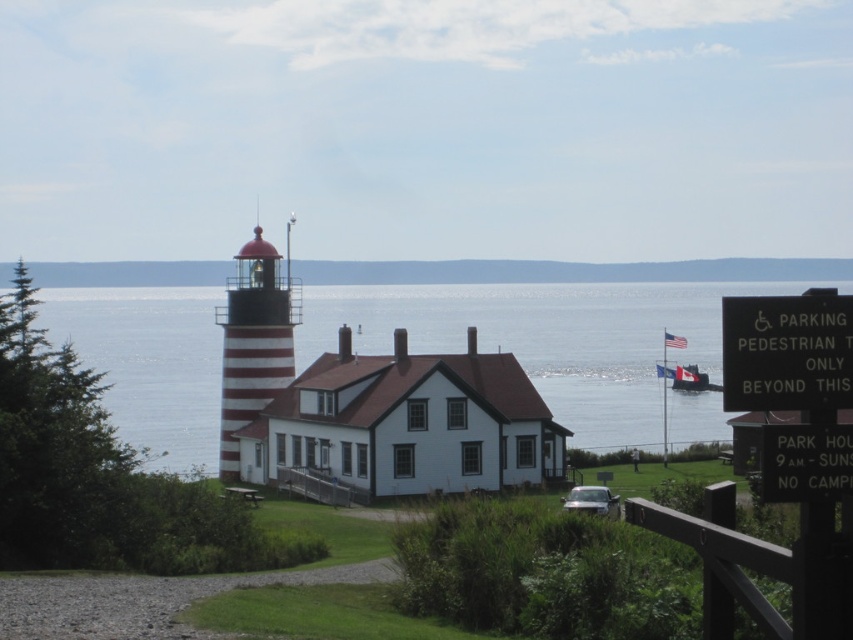
Between point (776, 445) and point (692, 381), which one is positioned in front?

Point (776, 445) is in front.

Can you confirm if black plastic sign at lower right is thinner than metallic gray boat at center?

Yes, black plastic sign at lower right is thinner than metallic gray boat at center.

Between point (805, 442) and point (675, 388), which one is positioned behind?

Point (675, 388)

This screenshot has height=640, width=853. Identify the location of black plastic sign at lower right. (805, 461).

Who is higher up, black plastic sign at right or metallic gray boat at center?

Positioned higher is black plastic sign at right.

Find the location of a particular element. black plastic sign at right is located at coordinates (787, 352).

Is blue water at center smaller than metallic gray boat at center?

No, blue water at center is not smaller than metallic gray boat at center.

Is blue water at center positioned at the back of metallic gray boat at center?

No, blue water at center is in front of metallic gray boat at center.

Is point (680, 358) more distant than point (693, 369)?

Yes, it is.

I want to click on blue water at center, so click(549, 339).